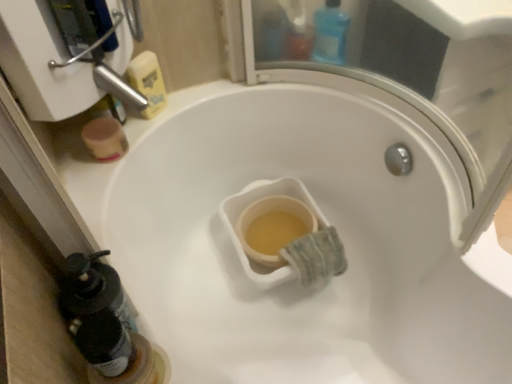
Question: From a real-world perspective, is translucent plastic bottle at lower left, which ranks as the first bottle in left-to-right order, physically located above or below yellow matte sponge at upper left?

Choices:
 (A) above
 (B) below

Answer: (A)

Question: From their relative heights in the image, would you say translucent plastic bottle at lower left, acting as the first bottle starting from the front, is taller or shorter than yellow matte sponge at upper left?

Choices:
 (A) short
 (B) tall

Answer: (A)

Question: Which of these objects is positioned closest to the blue plastic bottle at upper center, the second bottle when ordered from front to back?

Choices:
 (A) yellow matte sponge at upper left
 (B) translucent plastic bottle at lower left, acting as the first bottle starting from the front

Answer: (A)

Question: Which object is the farthest from the blue plastic bottle at upper center, the first bottle from the back?

Choices:
 (A) translucent plastic bottle at lower left, acting as the 2th bottle starting from the top
 (B) yellow matte sponge at upper left

Answer: (A)